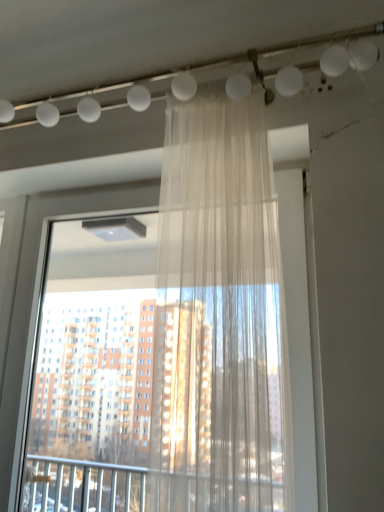
Question: Is point (56, 197) positioned closer to the camera than point (208, 272)?

Choices:
 (A) farther
 (B) closer

Answer: (A)

Question: Is transparent fabric curtain at center bigger or smaller than sheer white curtain at center?

Choices:
 (A) big
 (B) small

Answer: (A)

Question: Is transparent fabric curtain at center in front of or behind sheer white curtain at center in the image?

Choices:
 (A) front
 (B) behind

Answer: (B)

Question: From the image's perspective, is sheer white curtain at center above or below transparent fabric curtain at center?

Choices:
 (A) below
 (B) above

Answer: (B)

Question: Visually, is sheer white curtain at center positioned to the left or to the right of transparent fabric curtain at center?

Choices:
 (A) right
 (B) left

Answer: (A)

Question: Relative to transparent fabric curtain at center, is sheer white curtain at center in front or behind?

Choices:
 (A) front
 (B) behind

Answer: (A)

Question: Is sheer white curtain at center taller or shorter than transparent fabric curtain at center?

Choices:
 (A) short
 (B) tall

Answer: (A)